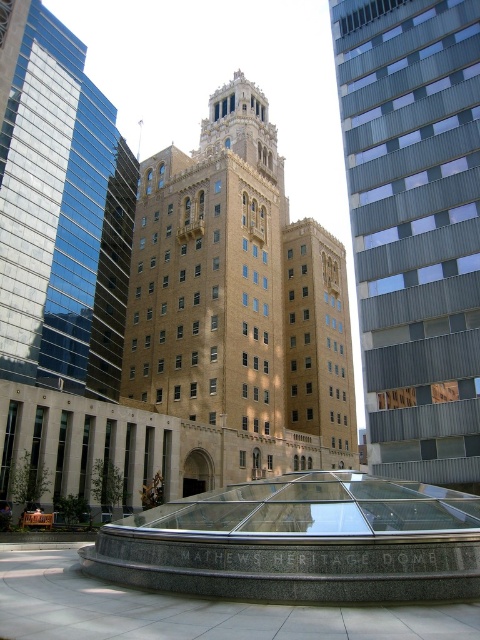
Based on the photo, you are a city planner assessing the layout of this historic area. You need to install a new 10 meter wide walkway between the brown brick bell tower at center and the brick tower at center. Is there enough space between them to place the walkway?

The brown brick bell tower at center and the brick tower at center are 18.64 meters apart. Since the walkway is 10 meters wide, there is sufficient space between them to place the walkway as the distance between them is greater than the walkway width.

You are standing in the plaza in front of the MATHEWS HERITAGE DOME. You want to take a photo that includes both the brown brick bell tower at center and the glass dome roof of the MATHEWS HERITAGE DOME. Considering your camera can capture a maximum distance of 50 meters, will you be able to include both in the same frame?

The brown brick bell tower at center is 57.96 meters away from the viewer, which exceeds the camera maximum distance of 50 meters. Therefore, you cannot include both in the same frame.